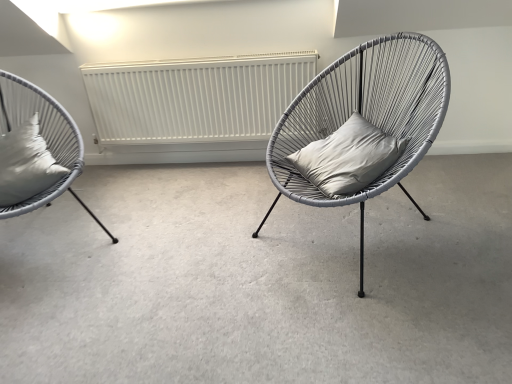
Question: In terms of height, does matte gray wicker chair at center, placed as the 2th chair when sorted from left to right, look taller or shorter compared to satin white cushion at left, the second pillow positioned from the right?

Choices:
 (A) tall
 (B) short

Answer: (A)

Question: Would you say matte gray wicker chair at center, placed as the 2th chair when sorted from left to right, is to the left or to the right of satin white cushion at left, the second pillow positioned from the right, in the picture?

Choices:
 (A) right
 (B) left

Answer: (A)

Question: Which object is positioned closest to the matte gray wicker chair at center, placed as the 2th chair when sorted from left to right?

Choices:
 (A) white matte radiator at center
 (B) gray matte pillow at center, the first pillow in the right-to-left sequence
 (C) gray matte cushion at center
 (D) satin white cushion at left, the first pillow viewed from the left
 (E) matte gray wicker chair at left, which is counted as the first chair, starting from the left

Answer: (B)

Question: Estimate the real-world distances between objects in this image. Which object is closer to the gray matte cushion at center?

Choices:
 (A) satin white cushion at left, the second pillow positioned from the right
 (B) matte gray wicker chair at left, which is the 2th chair from right to left
 (C) gray matte pillow at center, the first pillow in the right-to-left sequence
 (D) white matte radiator at center
 (E) matte gray wicker chair at center, placed as the 2th chair when sorted from left to right

Answer: (E)